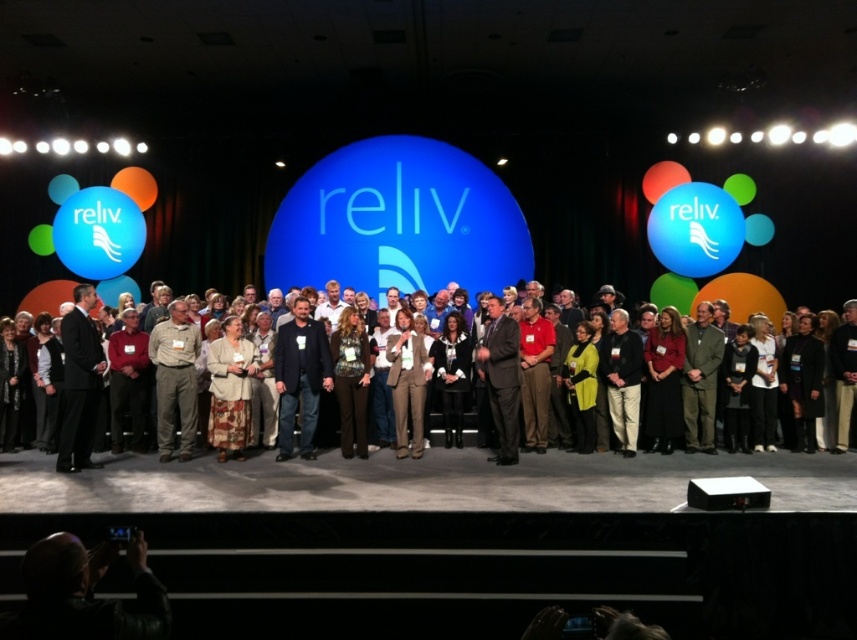
What do you see at coordinates (175, 380) in the screenshot? I see `khaki pants at center` at bounding box center [175, 380].

Consider the image. Who is taller, khaki pants at center or dark brown leather jacket at center?

khaki pants at center

I want to click on khaki pants at center, so click(x=175, y=380).

Find the location of a particular element. The height and width of the screenshot is (640, 857). khaki pants at center is located at coordinates (175, 380).

Who is shorter, dark blue jeans at center or khaki pants at center?

khaki pants at center is shorter.

Can you confirm if dark blue jeans at center is bigger than khaki pants at center?

Incorrect, dark blue jeans at center is not larger than khaki pants at center.

Which is in front, point (304, 404) or point (189, 440)?

Point (189, 440) is more forward.

Locate an element on the screen. The width and height of the screenshot is (857, 640). dark blue jeans at center is located at coordinates (300, 378).

Which is behind, point (303, 428) or point (382, 456)?

The point (382, 456) is behind.

Between point (315, 323) and point (37, 467), which one is positioned behind?

The point (315, 323) is behind.

Identify the location of dark blue jeans at center. (x=300, y=378).